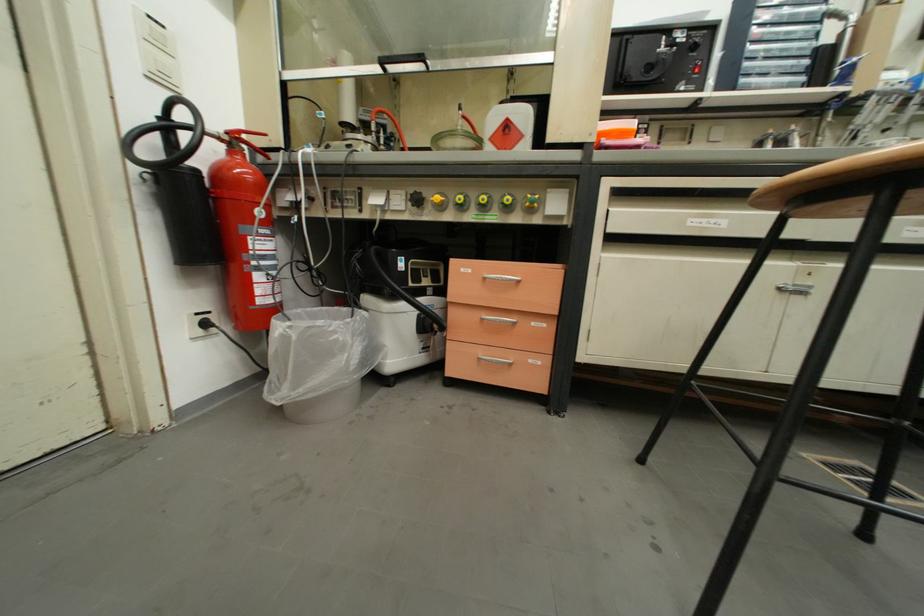
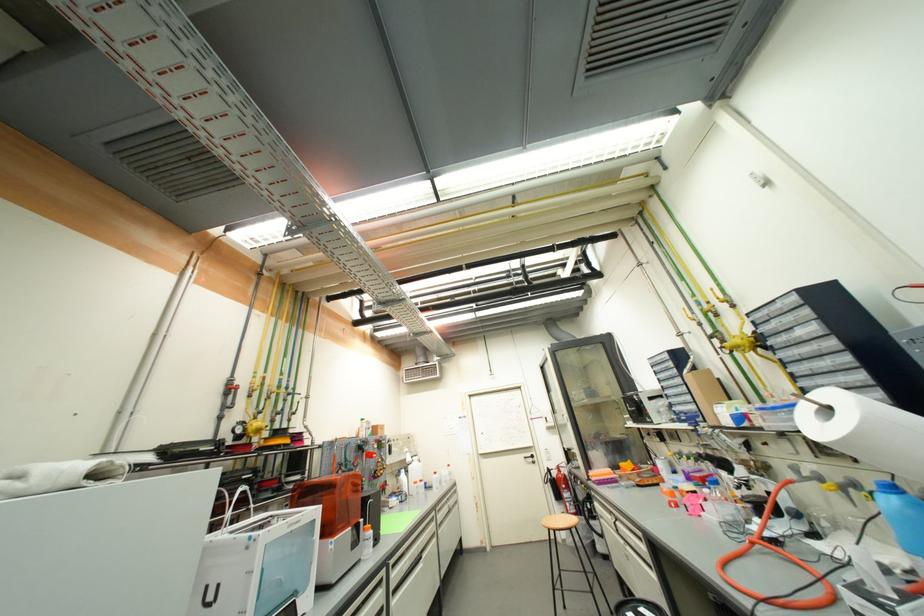
Locate, in the second image, the point that corresponds to (x=277, y=259) in the first image.

(575, 500)